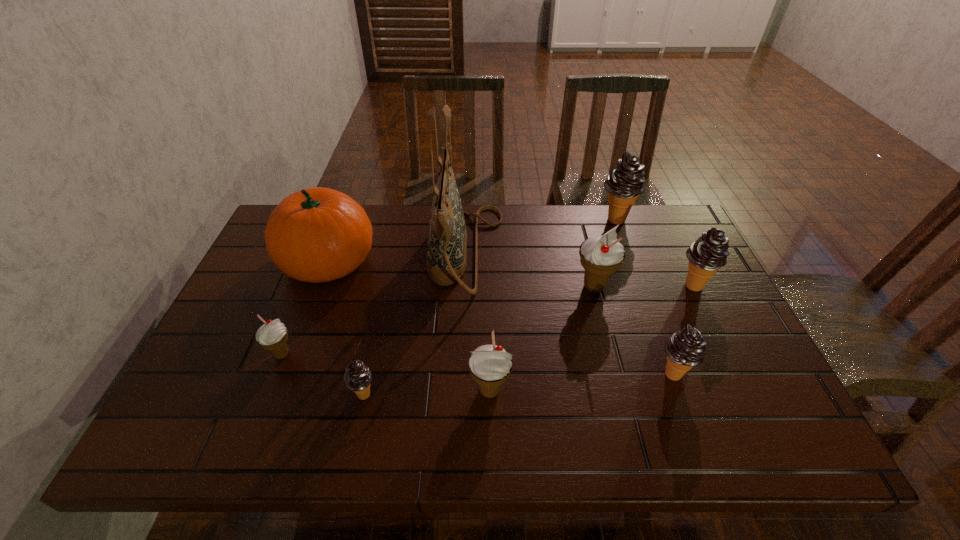
Identify the location of free spot between the biggest chocolate icecream and the second smallest chocolate icecream. The width and height of the screenshot is (960, 540). (644, 296).

Locate an element on the screen. This screenshot has width=960, height=540. free space that is in between the seventh object from right to left and the second farthest white icecream is located at coordinates (323, 374).

Where is `free area in between the third biggest chocolate icecream and the tallest icecream`? The image size is (960, 540). free area in between the third biggest chocolate icecream and the tallest icecream is located at coordinates (644, 296).

Image resolution: width=960 pixels, height=540 pixels. I want to click on blank region between the third biggest chocolate icecream and the biggest chocolate icecream, so click(x=644, y=296).

Locate which object is the seventh closest to the sixth icecream from right to left. Please provide its 2D coordinates. Your answer should be formatted as a tuple, i.e. [(x, y)], where the tuple contains the x and y coordinates of a point satisfying the conditions above.

[(708, 254)]

Point out which object is positioned as the fourth nearest to the tallest object. Please provide its 2D coordinates. Your answer should be formatted as a tuple, i.e. [(x, y)], where the tuple contains the x and y coordinates of a point satisfying the conditions above.

[(357, 378)]

Identify which icecream is the third nearest to the leftmost icecream. Please provide its 2D coordinates. Your answer should be formatted as a tuple, i.e. [(x, y)], where the tuple contains the x and y coordinates of a point satisfying the conditions above.

[(601, 255)]

This screenshot has height=540, width=960. I want to click on the sixth closest icecream to the tallest icecream, so click(273, 335).

The width and height of the screenshot is (960, 540). Find the location of `chocolate icecream that is the third nearest to the second smallest chocolate icecream`. chocolate icecream that is the third nearest to the second smallest chocolate icecream is located at coordinates pos(357,378).

The height and width of the screenshot is (540, 960). What are the coordinates of `the fourth closest chocolate icecream to the tallest object` in the screenshot? It's located at (708, 254).